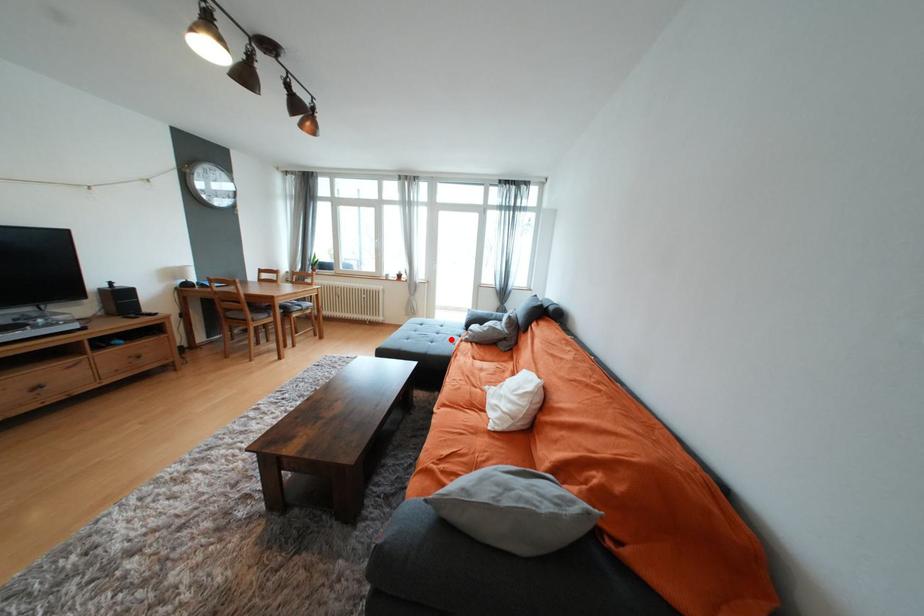
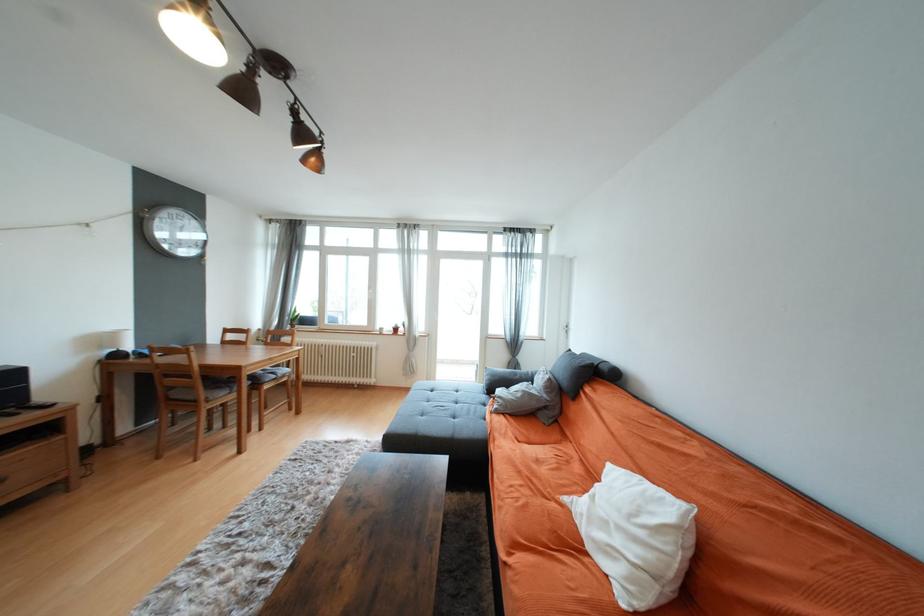
In the second image, find the point that corresponds to the highlighted location in the first image.

(475, 411)